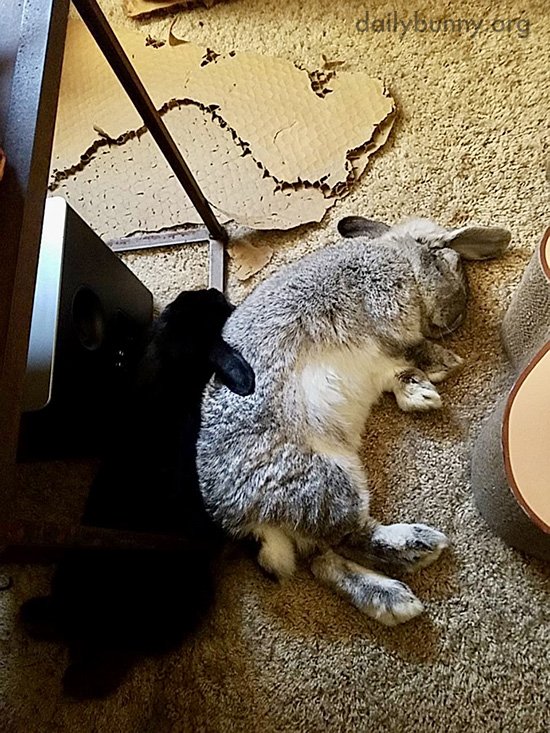
The height and width of the screenshot is (733, 550). What are the coordinates of `table` in the screenshot? It's located at (20, 69).